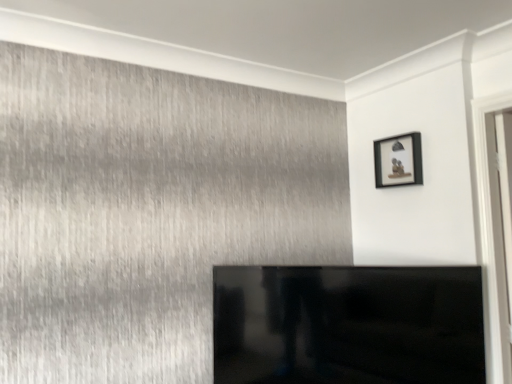
Question: Choose the correct answer: Is matte black picture frame at upper right inside black glossy tv at center or outside it?

Choices:
 (A) inside
 (B) outside

Answer: (B)

Question: Considering the positions of point (388, 165) and point (478, 365), is point (388, 165) closer or farther from the camera than point (478, 365)?

Choices:
 (A) closer
 (B) farther

Answer: (B)

Question: Looking at their shapes, would you say matte black picture frame at upper right is wider or thinner than black glossy tv at center?

Choices:
 (A) wide
 (B) thin

Answer: (B)

Question: Considering their positions, is black glossy tv at center located in front of or behind matte black picture frame at upper right?

Choices:
 (A) front
 (B) behind

Answer: (A)

Question: Is black glossy tv at center spatially inside matte black picture frame at upper right, or outside of it?

Choices:
 (A) outside
 (B) inside

Answer: (A)

Question: Considering the positions of point (379, 271) and point (397, 148), is point (379, 271) closer or farther from the camera than point (397, 148)?

Choices:
 (A) closer
 (B) farther

Answer: (A)

Question: From a real-world perspective, is black glossy tv at center positioned above or below matte black picture frame at upper right?

Choices:
 (A) above
 (B) below

Answer: (B)